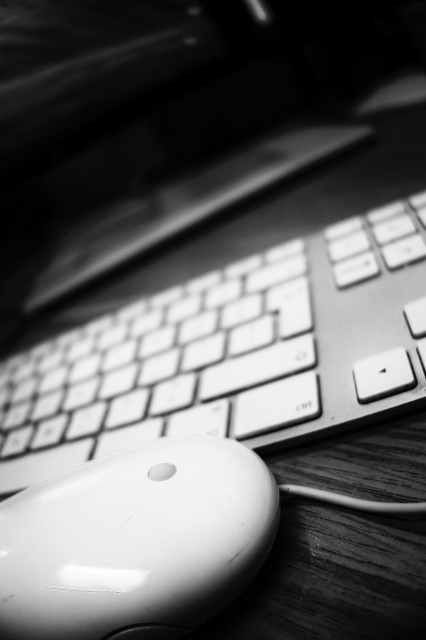
What do you see at coordinates (233, 352) in the screenshot? The image size is (426, 640). I see `white plastic keyboard at center` at bounding box center [233, 352].

From the picture: Can you confirm if white plastic keyboard at center is thinner than white glossy mouse at lower left?

No, white plastic keyboard at center is not thinner than white glossy mouse at lower left.

Identify the location of white plastic keyboard at center. This screenshot has height=640, width=426. (233, 352).